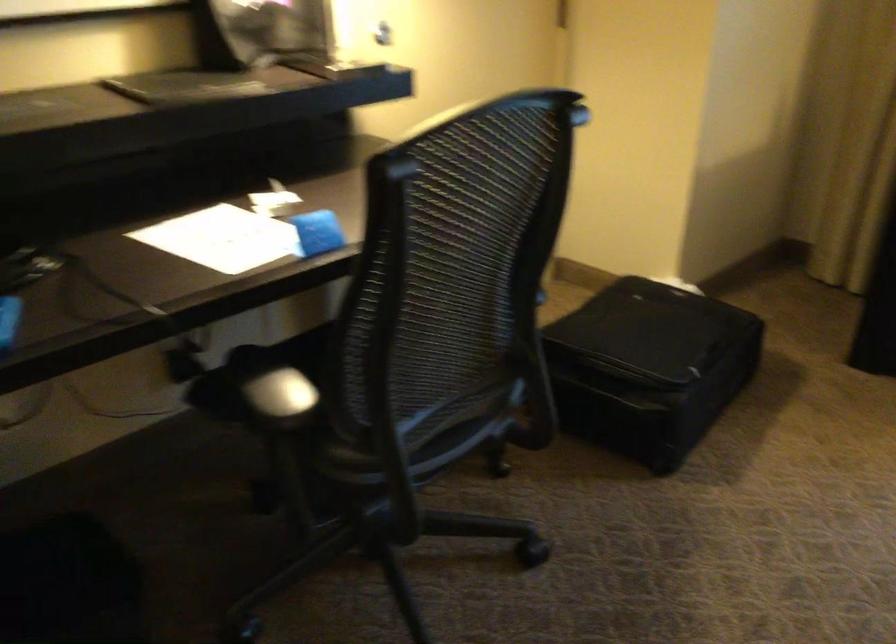
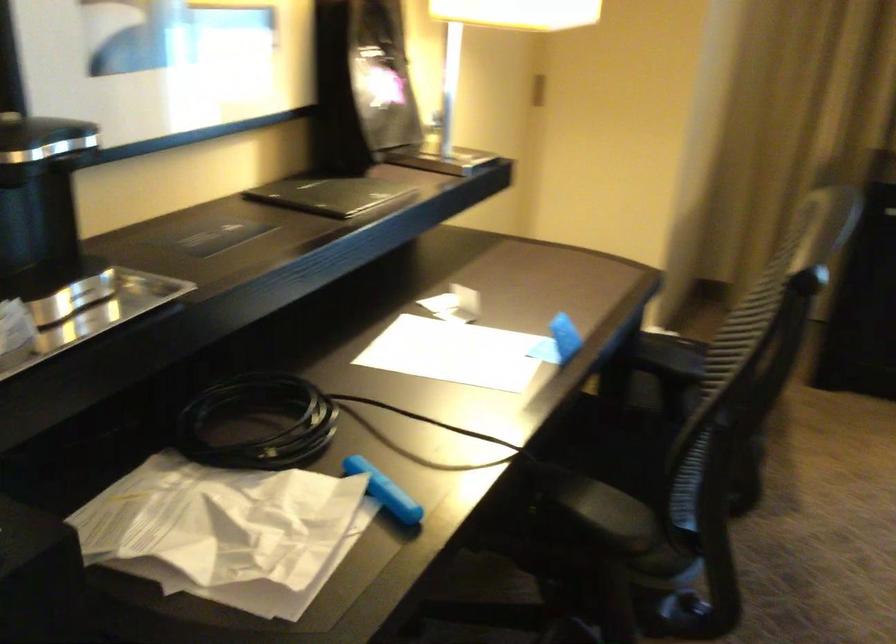
Find the pixel in the second image that matches pixel 427 372 in the first image.

(625, 457)